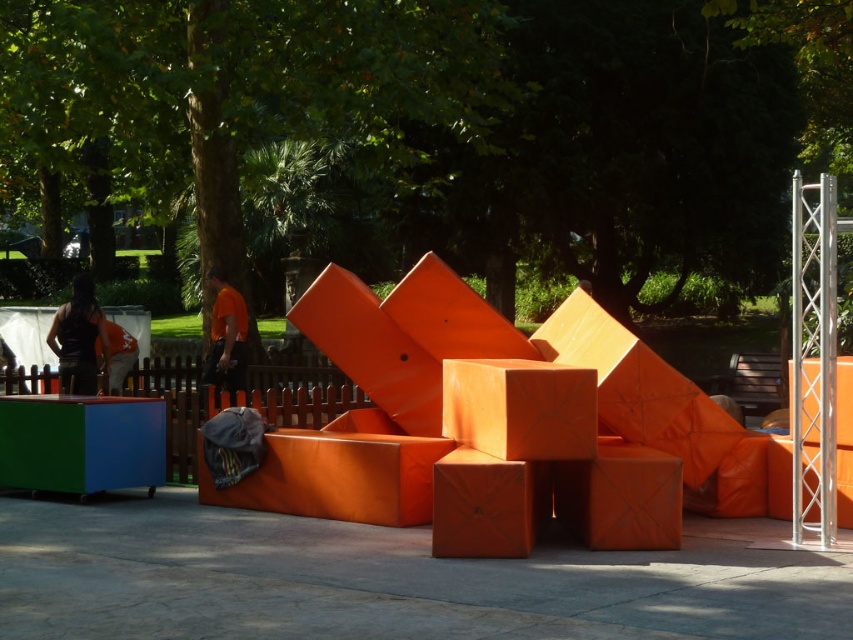
Can you confirm if orange matte block at center is positioned to the left of black fabric at left?

Incorrect, orange matte block at center is not on the left side of black fabric at left.

Locate an element on the screen. The image size is (853, 640). orange matte block at center is located at coordinates (520, 408).

Is point (570, 454) closer to viewer compared to point (62, 308)?

Yes, point (570, 454) is in front of point (62, 308).

Where is `orange matte block at center`? orange matte block at center is located at coordinates (520, 408).

Which is above, orange matte block at center or matte orange cube at center?

Positioned higher is orange matte block at center.

Who is more distant from viewer, (495, 424) or (502, 532)?

The point (495, 424) is more distant.

Where is `orange matte block at center`? orange matte block at center is located at coordinates (520, 408).

Does matte orange cube at center appear on the right side of orange matte shirt at center?

Correct, you'll find matte orange cube at center to the right of orange matte shirt at center.

Which is behind, point (502, 538) or point (218, 316)?

The point (218, 316) is behind.

Who is more forward, (509,515) or (229,292)?

Point (509,515) is in front.

Find the location of `matte orange cube at center`. matte orange cube at center is located at coordinates (486, 504).